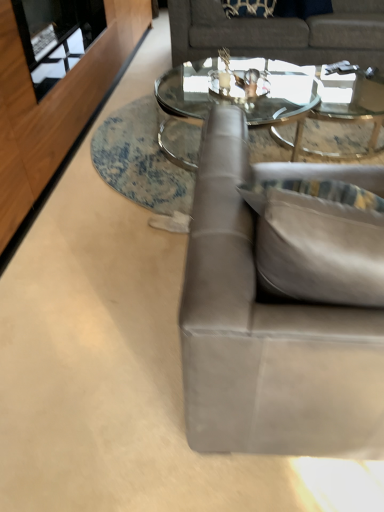
Question: Do you think transparent glass door at upper left is within gray fabric couch at upper center, placed as the 2th studio couch when sorted from front to back, or outside of it?

Choices:
 (A) inside
 (B) outside

Answer: (B)

Question: Looking at their shapes, would you say transparent glass door at upper left is wider or thinner than gray fabric couch at upper center, the 1th studio couch when ordered from back to front?

Choices:
 (A) thin
 (B) wide

Answer: (A)

Question: Which object is the farthest from the gray fabric couch at upper center, acting as the second studio couch starting from the bottom?

Choices:
 (A) clear glass coffee table at center
 (B) suede gray couch at right, acting as the first studio couch starting from the front
 (C) transparent glass door at upper left

Answer: (B)

Question: Estimate the real-world distances between objects in this image. Which object is farther from the suede gray couch at right, which appears as the second studio couch when viewed from the back?

Choices:
 (A) clear glass coffee table at center
 (B) gray fabric couch at upper center, marked as the 1th studio couch in a top-to-bottom arrangement
 (C) transparent glass door at upper left

Answer: (B)